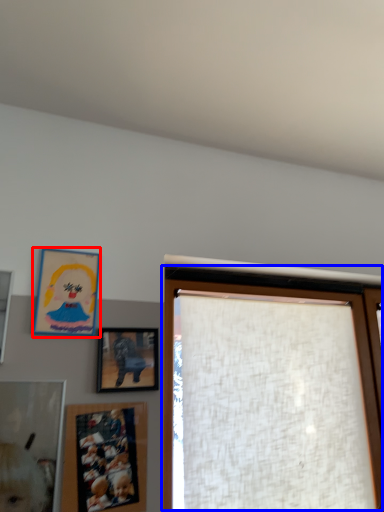
Question: Which object appears closest to the camera in this image, picture frame (highlighted by a red box) or window (highlighted by a blue box)?

Choices:
 (A) picture frame
 (B) window

Answer: (A)